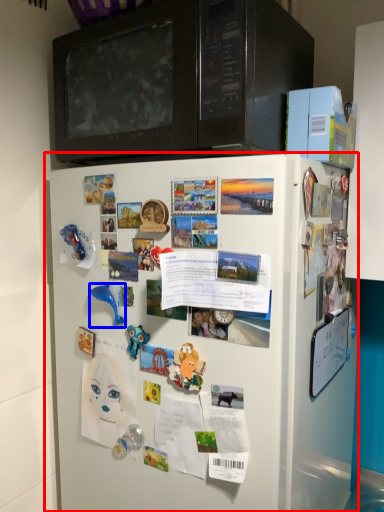
Question: Among these objects, which one is farthest to the camera, refrigerator (highlighted by a red box) or toy (highlighted by a blue box)?

Choices:
 (A) refrigerator
 (B) toy

Answer: (B)